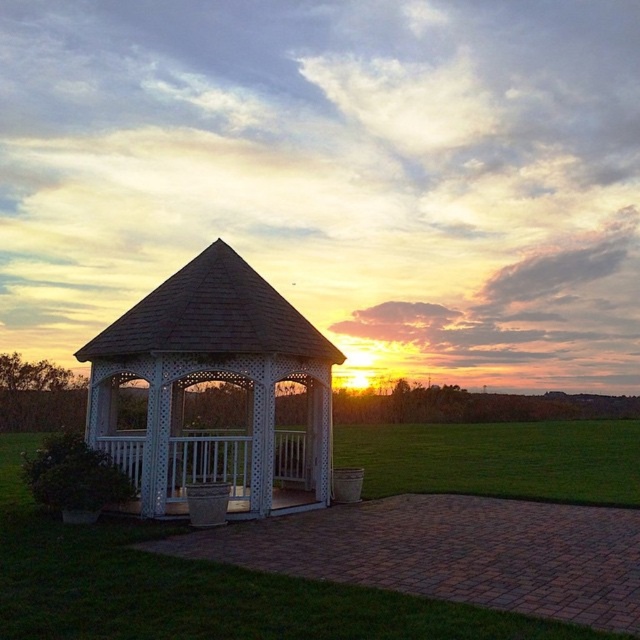
Which is above, green grass at center or white lattice gazebo at center?

white lattice gazebo at center is higher up.

Between green grass at center and white lattice gazebo at center, which one has less height?

white lattice gazebo at center is shorter.

Where is `green grass at center`? The width and height of the screenshot is (640, 640). green grass at center is located at coordinates (195, 588).